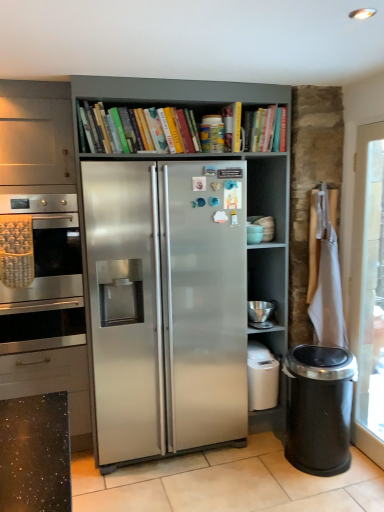
Question: From the image's perspective, is stainless steel oven at left on hardcover books at upper center?

Choices:
 (A) yes
 (B) no

Answer: (B)

Question: Considering the relative sizes of stainless steel oven at left and hardcover books at upper center in the image provided, is stainless steel oven at left taller than hardcover books at upper center?

Choices:
 (A) yes
 (B) no

Answer: (A)

Question: Can you confirm if stainless steel oven at left is shorter than hardcover books at upper center?

Choices:
 (A) no
 (B) yes

Answer: (A)

Question: From a real-world perspective, is stainless steel oven at left located higher than hardcover books at upper center?

Choices:
 (A) no
 (B) yes

Answer: (A)

Question: From the image's perspective, is stainless steel oven at left under hardcover books at upper center?

Choices:
 (A) yes
 (B) no

Answer: (A)

Question: Is stainless steel oven at left to the left or to the right of satin silver fridge at center in the image?

Choices:
 (A) left
 (B) right

Answer: (A)

Question: Is stainless steel oven at left spatially inside satin silver fridge at center, or outside of it?

Choices:
 (A) outside
 (B) inside

Answer: (A)

Question: Is point (44, 199) positioned closer to the camera than point (137, 173)?

Choices:
 (A) farther
 (B) closer

Answer: (A)

Question: From the image's perspective, is stainless steel oven at left above or below satin silver fridge at center?

Choices:
 (A) above
 (B) below

Answer: (A)

Question: Considering the positions of silver metallic bowl at lower right, the second appliance when ordered from top to bottom, and white glossy tile at center in the image, is silver metallic bowl at lower right, the second appliance when ordered from top to bottom, taller or shorter than white glossy tile at center?

Choices:
 (A) short
 (B) tall

Answer: (B)

Question: Is silver metallic bowl at lower right, the second appliance when ordered from top to bottom, situated inside white glossy tile at center or outside?

Choices:
 (A) inside
 (B) outside

Answer: (B)

Question: Is point (256, 315) closer or farther from the camera than point (344, 489)?

Choices:
 (A) farther
 (B) closer

Answer: (A)

Question: From the image's perspective, relative to white glossy tile at center, is silver metallic bowl at lower right, which is counted as the 1th appliance, starting from the bottom, above or below?

Choices:
 (A) below
 (B) above

Answer: (B)

Question: In terms of width, does silver metallic bowl at lower right, the second appliance when ordered from top to bottom, look wider or thinner when compared to satin silver fridge at center?

Choices:
 (A) wide
 (B) thin

Answer: (B)

Question: Considering the positions of point (253, 314) and point (117, 276), is point (253, 314) closer or farther from the camera than point (117, 276)?

Choices:
 (A) closer
 (B) farther

Answer: (B)